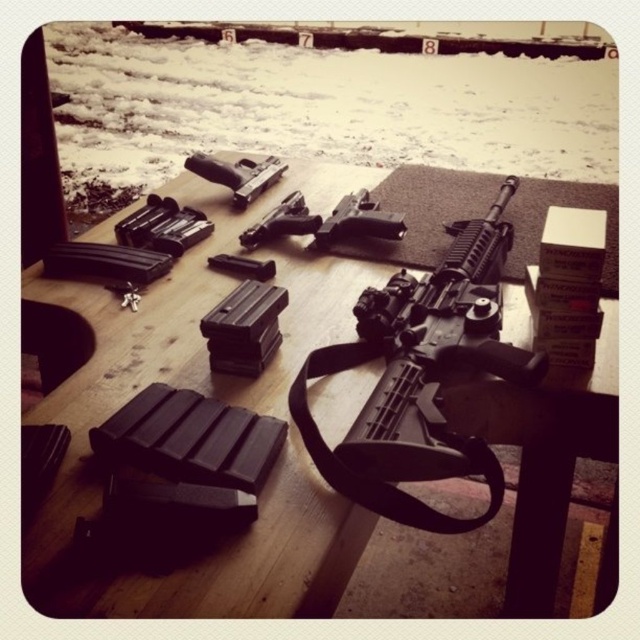
Question: Where is black matte picnic table at center located in relation to matte black handgun at center in the image?

Choices:
 (A) right
 (B) left

Answer: (A)

Question: Which point is farther to the camera?

Choices:
 (A) (262, 189)
 (B) (554, 468)

Answer: (A)

Question: Is black matte picnic table at center thinner than matte black handgun at center?

Choices:
 (A) yes
 (B) no

Answer: (B)

Question: Can you confirm if black matte picnic table at center is positioned above matte black handgun at center?

Choices:
 (A) no
 (B) yes

Answer: (A)

Question: Which point is farther to the camera?

Choices:
 (A) matte black handgun at center
 (B) black matte picnic table at center

Answer: (A)